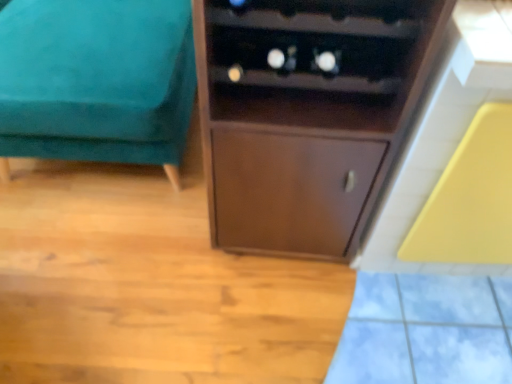
Locate an element on the screen. Image resolution: width=512 pixels, height=384 pixels. brown wood cupboard at center is located at coordinates (306, 114).

Describe the element at coordinates (306, 114) in the screenshot. I see `brown wood cupboard at center` at that location.

Find the location of a particular element. This screenshot has height=384, width=512. teal velvet ottoman at left is located at coordinates (97, 80).

The height and width of the screenshot is (384, 512). Describe the element at coordinates (97, 80) in the screenshot. I see `teal velvet ottoman at left` at that location.

This screenshot has height=384, width=512. What are the coordinates of `brown wood cupboard at center` in the screenshot? It's located at (306, 114).

From the picture: Is teal velvet ottoman at left to the left or to the right of brown wood cupboard at center in the image?

Based on their positions, teal velvet ottoman at left is located to the left of brown wood cupboard at center.

Is teal velvet ottoman at left closer to camera compared to brown wood cupboard at center?

No, teal velvet ottoman at left is further to the viewer.

Considering the points (98, 133) and (247, 13), which point is in front, point (98, 133) or point (247, 13)?

Point (247, 13)

From the image's perspective, relative to brown wood cupboard at center, is teal velvet ottoman at left above or below?

Based on their image positions, teal velvet ottoman at left is located above brown wood cupboard at center.

From a real-world perspective, does teal velvet ottoman at left stand above brown wood cupboard at center?

No, from a real-world perspective, teal velvet ottoman at left is not on top of brown wood cupboard at center.

Between teal velvet ottoman at left and brown wood cupboard at center, which one has larger width?

teal velvet ottoman at left is wider.

Considering the sizes of objects teal velvet ottoman at left and brown wood cupboard at center in the image provided, who is taller, teal velvet ottoman at left or brown wood cupboard at center?

brown wood cupboard at center is taller.

Looking at this image, looking at the image, does teal velvet ottoman at left seem bigger or smaller compared to brown wood cupboard at center?

In the image, teal velvet ottoman at left appears to be larger than brown wood cupboard at center.

From the picture: Do you think teal velvet ottoman at left is within brown wood cupboard at center, or outside of it?

teal velvet ottoman at left cannot be found inside brown wood cupboard at center.

Is teal velvet ottoman at left in contact with brown wood cupboard at center?

teal velvet ottoman at left is not next to brown wood cupboard at center, and they're not touching.

Is teal velvet ottoman at left positioned with its back to brown wood cupboard at center?

No, brown wood cupboard at center is not at the back of teal velvet ottoman at left.

The image size is (512, 384). I want to click on cupboard to the right of teal velvet ottoman at left, so click(x=306, y=114).

Does brown wood cupboard at center appear on the right side of teal velvet ottoman at left?

Yes, brown wood cupboard at center is to the right of teal velvet ottoman at left.

Relative to teal velvet ottoman at left, is brown wood cupboard at center in front or behind?

In the image, brown wood cupboard at center appears in front of teal velvet ottoman at left.

Considering the positions of points (310, 35) and (66, 30), is point (310, 35) farther from camera compared to point (66, 30)?

No.

From the image's perspective, which one is positioned lower, brown wood cupboard at center or teal velvet ottoman at left?

From the image's view, brown wood cupboard at center is below.

From a real-world perspective, relative to teal velvet ottoman at left, is brown wood cupboard at center vertically above or below?

brown wood cupboard at center is situated higher than teal velvet ottoman at left in the real world.

Is brown wood cupboard at center thinner than teal velvet ottoman at left?

Correct, the width of brown wood cupboard at center is less than that of teal velvet ottoman at left.

Between brown wood cupboard at center and teal velvet ottoman at left, which one has less height?

teal velvet ottoman at left is shorter.

Consider the image. Who is smaller, brown wood cupboard at center or teal velvet ottoman at left?

Smaller between the two is brown wood cupboard at center.

In the scene shown: Is teal velvet ottoman at left completely or partially inside brown wood cupboard at center?

Actually, teal velvet ottoman at left is outside brown wood cupboard at center.

Is brown wood cupboard at center beside teal velvet ottoman at left?

brown wood cupboard at center is not next to teal velvet ottoman at left, and they're not touching.

Is brown wood cupboard at center oriented towards teal velvet ottoman at left?

No, brown wood cupboard at center does not turn towards teal velvet ottoman at left.

Can you tell me how much brown wood cupboard at center and teal velvet ottoman at left differ in facing direction?

The angle between the facing direction of brown wood cupboard at center and the facing direction of teal velvet ottoman at left is 1.64 degrees.

Measure the distance between brown wood cupboard at center and teal velvet ottoman at left.

brown wood cupboard at center is 20.47 inches from teal velvet ottoman at left.

Identify the location of cupboard lying on the right of teal velvet ottoman at left. (306, 114).

Locate an element on the screen. furniture behind the brown wood cupboard at center is located at coordinates point(97,80).

At what (x,y) coordinates should I click in order to perform the action: click on furniture on the left of brown wood cupboard at center. Please return your answer as a coordinate pair (x, y). This screenshot has height=384, width=512. Looking at the image, I should click on (97, 80).